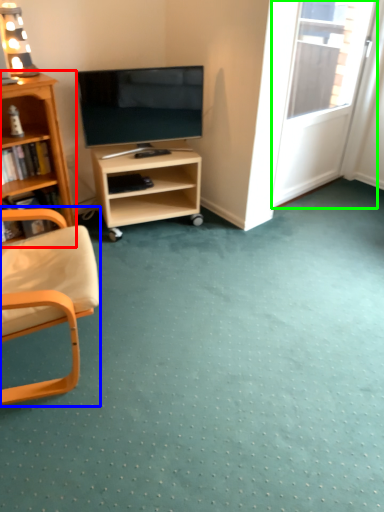
Question: Which object is positioned closest to bookcase (highlighted by a red box)? Select from chair (highlighted by a blue box) and screen door (highlighted by a green box).

Choices:
 (A) chair
 (B) screen door

Answer: (A)